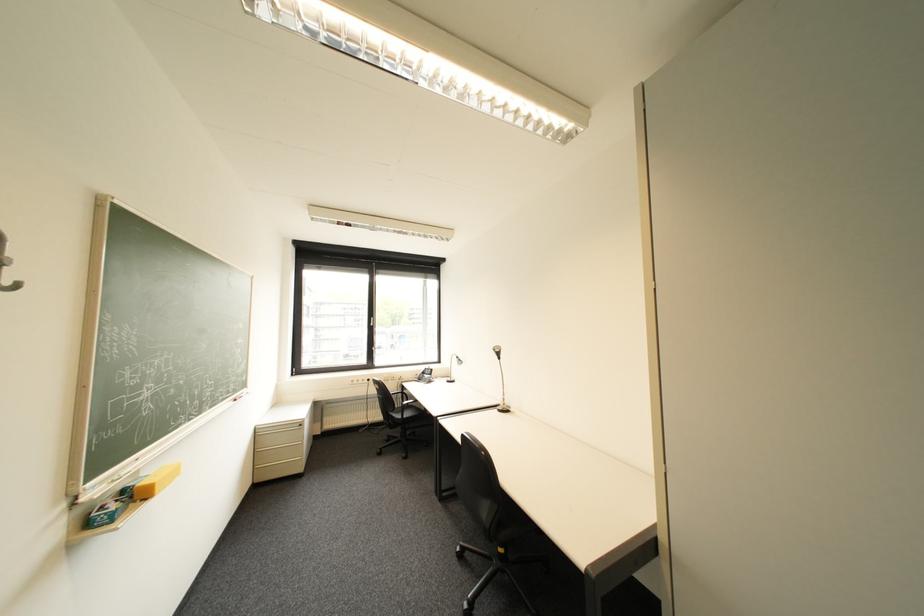
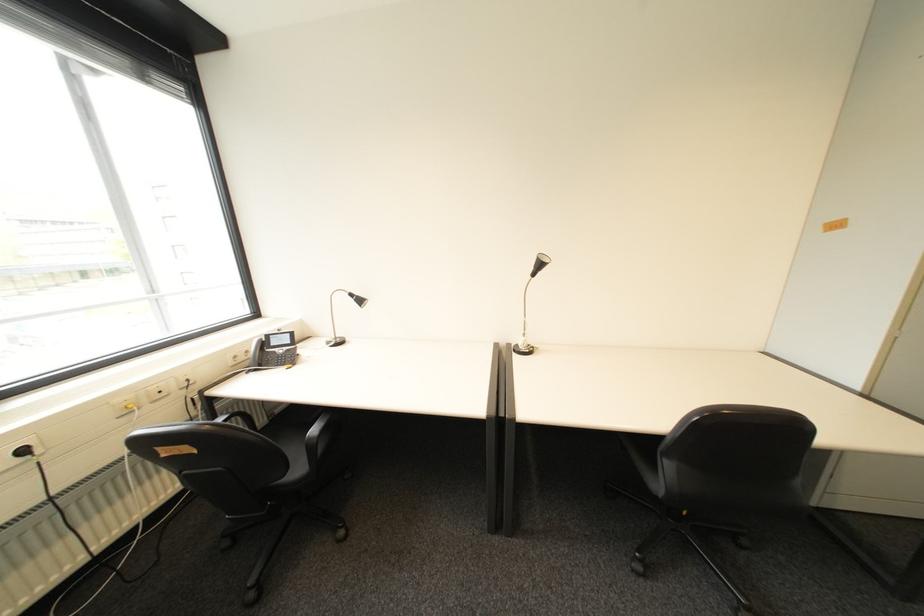
Locate, in the second image, the point that corresponds to point 379,381 in the first image.

(34, 452)